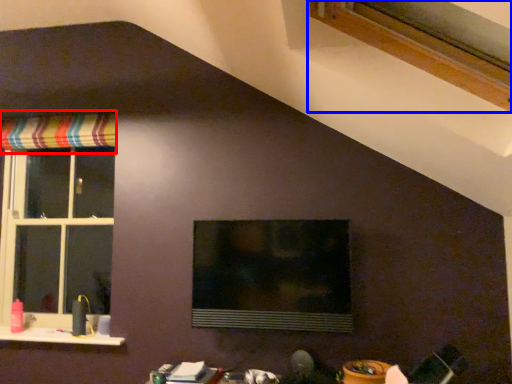
Question: Which object appears farthest to the camera in this image, curtain (highlighted by a red box) or window (highlighted by a blue box)?

Choices:
 (A) curtain
 (B) window

Answer: (A)